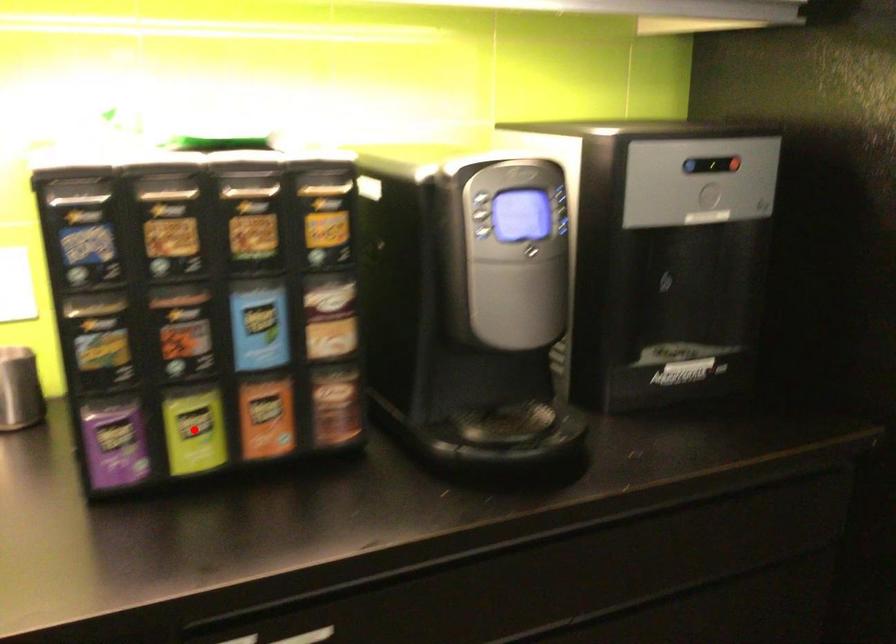
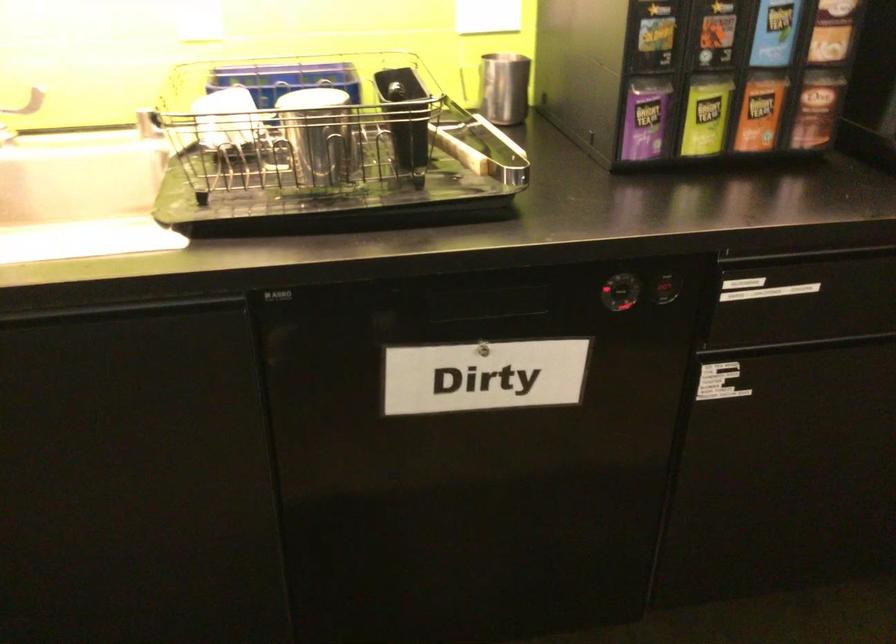
Question: I am providing you with two images of the same scene from different viewpoints. Image1 has a red point marked. In image2, the corresponding 3D location appears at what relative position? Reply with the corresponding letter.

Choices:
 (A) Closer
 (B) Farther

Answer: (B)